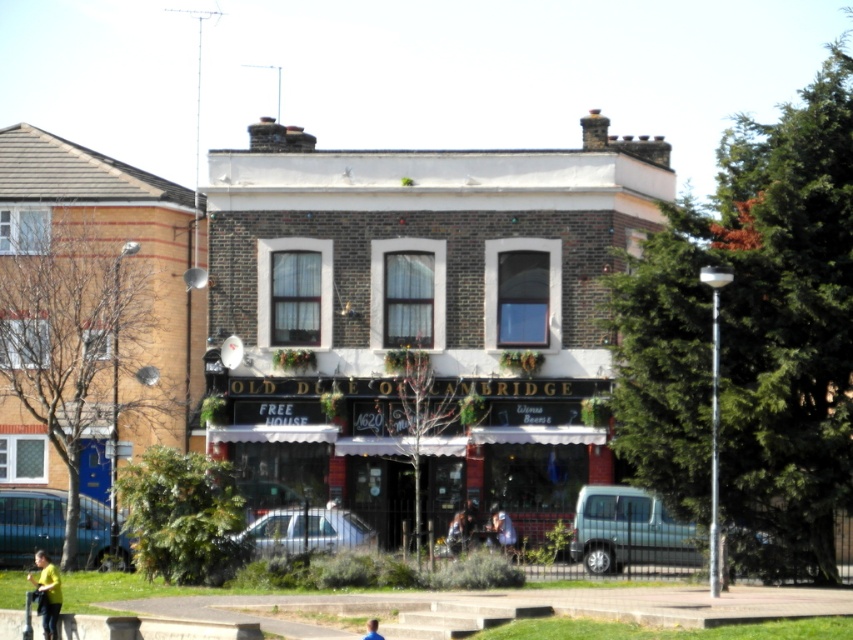
Question: Can you confirm if silver metallic van at lower right is wider than metallic silver car at center?

Choices:
 (A) yes
 (B) no

Answer: (A)

Question: Which object is farther from the camera taking this photo?

Choices:
 (A) silver metallic car at center
 (B) metallic silver car at center
 (C) black matte signboard at center
 (D) yellow fabric jacket at center

Answer: (C)

Question: Which object appears farthest from the camera in this image?

Choices:
 (A) silver metallic van at lower right
 (B) black matte signboard at center
 (C) brown brick building at center
 (D) light blue shirt at center

Answer: (B)

Question: Is black matte signboard at center above silver metallic car at center?

Choices:
 (A) yes
 (B) no

Answer: (A)

Question: Which point appears closest to the camera in this image?

Choices:
 (A) (373, 620)
 (B) (248, 509)

Answer: (A)

Question: In this image, where is black matte signboard at center located relative to yellow t-shirt at lower left?

Choices:
 (A) below
 (B) above

Answer: (B)